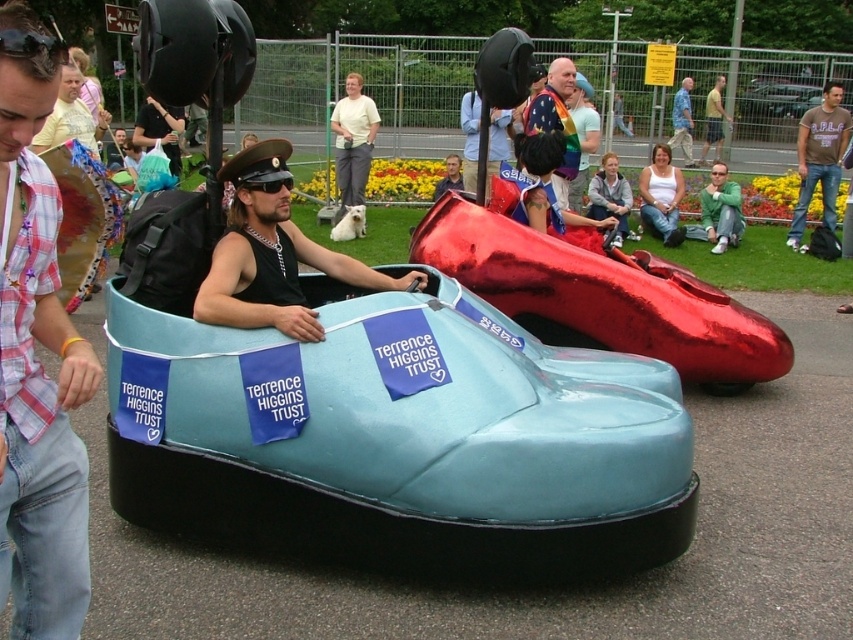
Between brown cotton t-shirt at right and light blue fabric car at center, which one is positioned higher?

light blue fabric car at center is higher up.

Does brown cotton t-shirt at right have a lesser height compared to light blue fabric car at center?

No.

Find the location of `brown cotton t-shirt at right`. brown cotton t-shirt at right is located at coordinates (819, 157).

Can you confirm if brown cotton t-shirt at right is wider than light yellow shirt at center?

Indeed, brown cotton t-shirt at right has a greater width compared to light yellow shirt at center.

Based on the photo, between brown cotton t-shirt at right and light yellow shirt at center, which one is positioned lower?

brown cotton t-shirt at right

Which is in front, point (805, 115) or point (339, 212)?

Positioned in front is point (805, 115).

Find the location of a particular element. brown cotton t-shirt at right is located at coordinates (819, 157).

Is glossy metallic shoe at center closer to camera compared to matte black hat at upper center?

Yes, glossy metallic shoe at center is closer to the viewer.

Is point (717, 353) positioned behind point (486, 152)?

Yes, it is.

Find the location of a particular element. glossy metallic shoe at center is located at coordinates (599, 292).